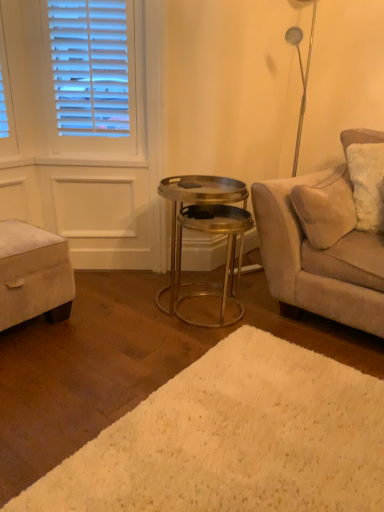
Question: From a real-world perspective, is metallic/golden table at center positioned under white shag rug at lower center based on gravity?

Choices:
 (A) no
 (B) yes

Answer: (A)

Question: From the image's perspective, would you say metallic/golden table at center is shown under white shag rug at lower center?

Choices:
 (A) yes
 (B) no

Answer: (B)

Question: From a real-world perspective, is metallic/golden table at center on white shag rug at lower center?

Choices:
 (A) yes
 (B) no

Answer: (A)

Question: Can you confirm if metallic/golden table at center is thinner than white shag rug at lower center?

Choices:
 (A) no
 (B) yes

Answer: (B)

Question: Considering the relative positions of metallic/golden table at center and white shag rug at lower center in the image provided, is metallic/golden table at center to the right of white shag rug at lower center from the viewer's perspective?

Choices:
 (A) yes
 (B) no

Answer: (B)

Question: Considering the relative sizes of metallic/golden table at center and white shag rug at lower center in the image provided, is metallic/golden table at center smaller than white shag rug at lower center?

Choices:
 (A) yes
 (B) no

Answer: (B)

Question: From a real-world perspective, is velvet beige ottoman at lower left located beneath metallic/golden table at center?

Choices:
 (A) yes
 (B) no

Answer: (A)

Question: Considering the relative positions of velvet beige ottoman at lower left and metallic/golden table at center in the image provided, is velvet beige ottoman at lower left to the left of metallic/golden table at center from the viewer's perspective?

Choices:
 (A) no
 (B) yes

Answer: (B)

Question: From the image's perspective, is velvet beige ottoman at lower left above metallic/golden table at center?

Choices:
 (A) yes
 (B) no

Answer: (B)

Question: Can you confirm if velvet beige ottoman at lower left is shorter than metallic/golden table at center?

Choices:
 (A) no
 (B) yes

Answer: (B)

Question: Does velvet beige ottoman at lower left touch metallic/golden table at center?

Choices:
 (A) no
 (B) yes

Answer: (A)

Question: Is velvet beige ottoman at lower left behind metallic/golden table at center?

Choices:
 (A) yes
 (B) no

Answer: (B)

Question: Is white shag rug at lower center not inside velvet beige ottoman at lower left?

Choices:
 (A) yes
 (B) no

Answer: (A)